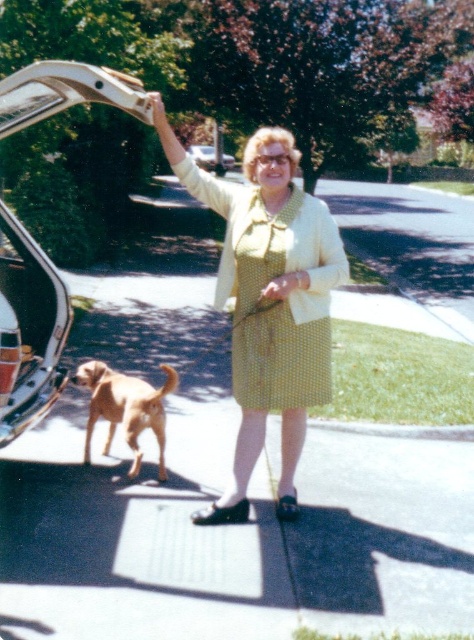
Who is positioned more to the right, golden fur dog at lower left or metallic silver car at center?

golden fur dog at lower left

Is golden fur dog at lower left to the left of metallic silver car at center from the viewer's perspective?

In fact, golden fur dog at lower left is to the right of metallic silver car at center.

Identify the location of golden fur dog at lower left. Image resolution: width=474 pixels, height=640 pixels. (125, 406).

The width and height of the screenshot is (474, 640). In order to click on golden fur dog at lower left in this screenshot , I will do `click(125, 406)`.

Does yellow dotted dress at center appear on the right side of metallic silver car at center?

Indeed, yellow dotted dress at center is positioned on the right side of metallic silver car at center.

Is point (227, 236) closer to camera compared to point (219, 161)?

Yes, it is in front of point (219, 161).

Between point (291, 228) and point (229, 160), which one is positioned in front?

Point (291, 228) is in front.

Where is `yellow dotted dress at center`? This screenshot has height=640, width=474. yellow dotted dress at center is located at coordinates (269, 300).

Is the position of metallic silver car at left less distant than that of golden fur dog at lower left?

Yes, metallic silver car at left is in front of golden fur dog at lower left.

Measure the distance between point (65, 99) and camera.

Point (65, 99) and camera are 4.65 meters apart.

Does point (18, 369) come farther from viewer compared to point (94, 381)?

No, (18, 369) is in front of (94, 381).

You are a GUI agent. You are given a task and a screenshot of the screen. Output one action in this format:
    pyautogui.click(x=<x>, y=<y>)
    Task: Click on the metallic silver car at left
    The height and width of the screenshot is (640, 474).
    Given the screenshot: What is the action you would take?
    pyautogui.click(x=28, y=330)